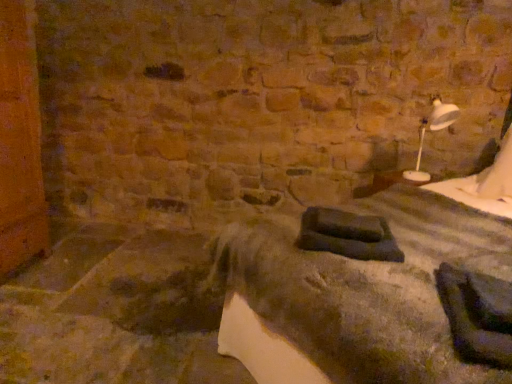
Question: Looking at their shapes, would you say white plastic lamp at upper right is wider or thinner than dark gray fabric bed at center?

Choices:
 (A) wide
 (B) thin

Answer: (B)

Question: Considering the positions of white plastic lamp at upper right and dark gray fabric bed at center in the image, is white plastic lamp at upper right taller or shorter than dark gray fabric bed at center?

Choices:
 (A) tall
 (B) short

Answer: (B)

Question: Considering the positions of point (449, 117) and point (495, 226), is point (449, 117) closer or farther from the camera than point (495, 226)?

Choices:
 (A) closer
 (B) farther

Answer: (B)

Question: Would you say dark gray fabric bed at center is to the left or to the right of white plastic lamp at upper right in the picture?

Choices:
 (A) left
 (B) right

Answer: (A)

Question: Would you say dark gray fabric bed at center is inside or outside white plastic lamp at upper right?

Choices:
 (A) inside
 (B) outside

Answer: (B)

Question: Considering the positions of dark gray fabric bed at center and white plastic lamp at upper right in the image, is dark gray fabric bed at center bigger or smaller than white plastic lamp at upper right?

Choices:
 (A) big
 (B) small

Answer: (A)

Question: Is point (251, 350) closer or farther from the camera than point (443, 127)?

Choices:
 (A) farther
 (B) closer

Answer: (B)